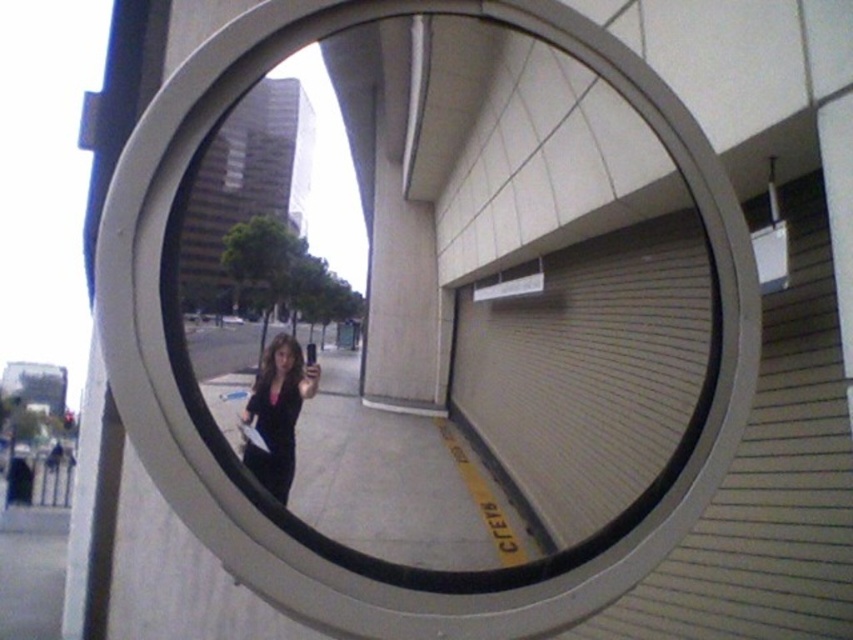
Question: Is clear glass mirror at center to the right of matte black jacket at center from the viewer's perspective?

Choices:
 (A) yes
 (B) no

Answer: (A)

Question: Which of the following is the closest to the observer?

Choices:
 (A) (289, 458)
 (B) (653, 346)

Answer: (A)

Question: Does clear glass mirror at center have a smaller size compared to matte black jacket at center?

Choices:
 (A) no
 (B) yes

Answer: (A)

Question: Can you confirm if clear glass mirror at center is positioned to the left of matte black jacket at center?

Choices:
 (A) no
 (B) yes

Answer: (A)